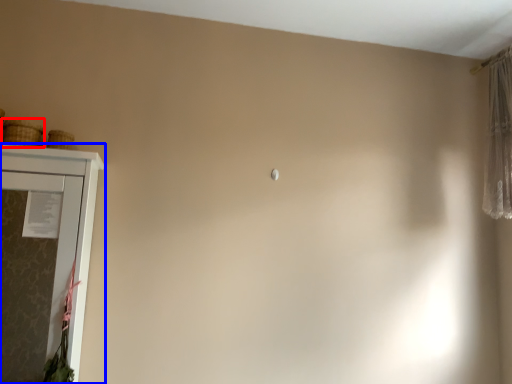
Question: Which of the following is the closest to the observer, basket (highlighted by a red box) or cupboard (highlighted by a blue box)?

Choices:
 (A) basket
 (B) cupboard

Answer: (B)